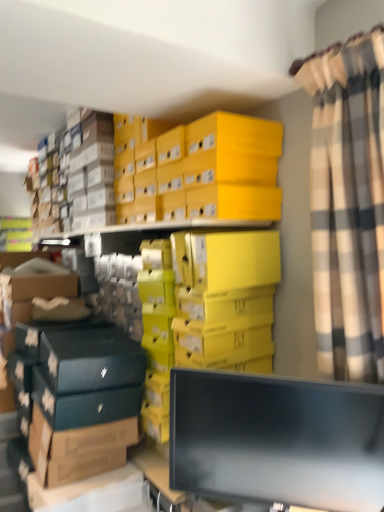
Question: Does yellow cardboard box at upper center have a smaller size compared to plaid fabric curtain at right?

Choices:
 (A) no
 (B) yes

Answer: (A)

Question: Is yellow cardboard box at upper center far from plaid fabric curtain at right?

Choices:
 (A) no
 (B) yes

Answer: (A)

Question: Is yellow cardboard box at upper center thinner than plaid fabric curtain at right?

Choices:
 (A) no
 (B) yes

Answer: (A)

Question: Can you confirm if yellow cardboard box at upper center is shorter than plaid fabric curtain at right?

Choices:
 (A) yes
 (B) no

Answer: (A)

Question: Is yellow cardboard box at upper center next to plaid fabric curtain at right?

Choices:
 (A) yes
 (B) no

Answer: (B)

Question: Is yellow cardboard box at upper center behind plaid fabric curtain at right?

Choices:
 (A) yes
 (B) no

Answer: (A)

Question: Is yellow cardboard box at upper center positioned far away from black glossy monitor at lower center?

Choices:
 (A) yes
 (B) no

Answer: (B)

Question: Can you confirm if yellow cardboard box at upper center is smaller than black glossy monitor at lower center?

Choices:
 (A) yes
 (B) no

Answer: (B)

Question: Does yellow cardboard box at upper center appear on the right side of black glossy monitor at lower center?

Choices:
 (A) no
 (B) yes

Answer: (A)

Question: From the image's perspective, is yellow cardboard box at upper center below black glossy monitor at lower center?

Choices:
 (A) no
 (B) yes

Answer: (A)

Question: Does yellow cardboard box at upper center have a larger size compared to black glossy monitor at lower center?

Choices:
 (A) yes
 (B) no

Answer: (A)

Question: Does yellow cardboard box at upper center come in front of black glossy monitor at lower center?

Choices:
 (A) no
 (B) yes

Answer: (A)

Question: From the image's perspective, is black glossy monitor at lower center located above plaid fabric curtain at right?

Choices:
 (A) yes
 (B) no

Answer: (B)